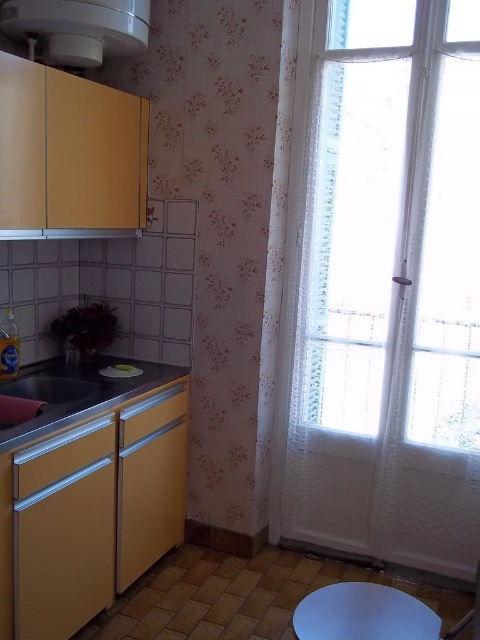
You are a chef preparing to place a heavy pot on the counter. Given that the metallic gray counter top at lower center is above the white matte stool at lower center, will placing the pot on the counter cause any obstruction to the stool?

The metallic gray counter top at lower center is positioned over the white matte stool at lower center, so placing the pot on the counter will not obstruct the stool since the counter itself is above the stool.

You are standing in the kitchen and want to reach both the white sheer curtain at right and the white glossy exhaust hood at upper left. Which object is closer to you?

The white sheer curtain at right is closer to you because it is further to the viewer than the white glossy exhaust hood at upper left, meaning it is nearer in your perspective.